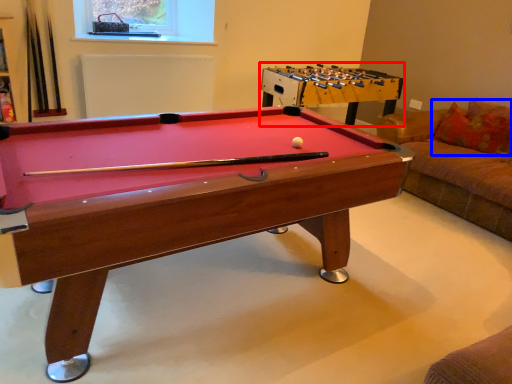
Question: Which object is further to the camera taking this photo, table (highlighted by a red box) or pillow (highlighted by a blue box)?

Choices:
 (A) table
 (B) pillow

Answer: (A)